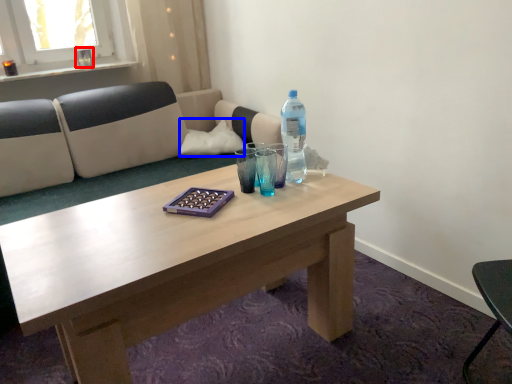
Question: Which of the following is the farthest to the observer, glass vase (highlighted by a red box) or pillow (highlighted by a blue box)?

Choices:
 (A) glass vase
 (B) pillow

Answer: (A)